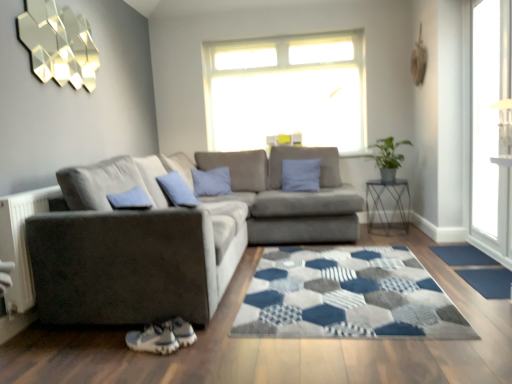
Describe the element at coordinates (462, 255) in the screenshot. I see `blue fabric doormat at lower right, arranged as the second doormat when viewed from the front` at that location.

The image size is (512, 384). What do you see at coordinates (153, 339) in the screenshot? I see `white mesh shoe at lower left` at bounding box center [153, 339].

You are a GUI agent. You are given a task and a screenshot of the screen. Output one action in this format:
    pyautogui.click(x=<x>, y=<y>)
    Task: Click on the transparent glass door at right
    The width and height of the screenshot is (512, 384).
    Given the screenshot: What is the action you would take?
    pyautogui.click(x=490, y=117)

Identify the location of blue fabric doormat at lower right, placed as the 1th doormat when sorted from front to back. (489, 282).

Find the location of a particular element. The width and height of the screenshot is (512, 384). metallic wire table at right is located at coordinates (389, 208).

At what (x,y) coordinates should I click in order to perform the action: click on blue fabric doormat at lower right, acting as the first doormat starting from the back. Please return your answer as a coordinate pair (x, y). The width and height of the screenshot is (512, 384). Looking at the image, I should click on (462, 255).

Locate an element on the screen. glass door in front of the blue fabric pillow at center is located at coordinates (490, 117).

Is blue fabric pillow at center oriented away from transparent glass door at right?

No, transparent glass door at right is not at the back of blue fabric pillow at center.

Considering the points (188, 193) and (480, 226), which point is behind, point (188, 193) or point (480, 226)?

Point (188, 193)

Between white plastic radiator at lower left and white mesh shoe at lower left, which one has more height?

With more height is white plastic radiator at lower left.

From a real-world perspective, is white plastic radiator at lower left over white mesh shoe at lower left?

Yes, from a real-world perspective, white plastic radiator at lower left is over white mesh shoe at lower left

Which object is positioned more to the right, white plastic radiator at lower left or white mesh shoe at lower left?

white mesh shoe at lower left.

Considering the positions of objects white plastic radiator at lower left and white mesh shoe at lower left in the image provided, who is behind, white plastic radiator at lower left or white mesh shoe at lower left?

white plastic radiator at lower left is behind.

Based on the photo, could you tell me if transparent glass door at right is facing suede gray couch at center?

Yes, transparent glass door at right is facing suede gray couch at center.

Is transparent glass door at right beside suede gray couch at center?

No, transparent glass door at right is not in contact with suede gray couch at center.

From the image's perspective, between transparent glass door at right and suede gray couch at center, which one is located above?

transparent glass door at right.

Is point (498, 0) closer or farther from the camera than point (128, 258)?

Point (498, 0).

From the image's perspective, is blue fabric doormat at lower right, acting as the first doormat starting from the back, positioned above or below transparent glass door at right?

blue fabric doormat at lower right, acting as the first doormat starting from the back, is below transparent glass door at right.

Is blue fabric doormat at lower right, arranged as the second doormat when viewed from the front, bigger than transparent glass door at right?

Actually, blue fabric doormat at lower right, arranged as the second doormat when viewed from the front, might be smaller than transparent glass door at right.

Considering the positions of objects blue fabric doormat at lower right, acting as the first doormat starting from the back, and transparent glass door at right in the image provided, who is more to the left, blue fabric doormat at lower right, acting as the first doormat starting from the back, or transparent glass door at right?

From the viewer's perspective, blue fabric doormat at lower right, acting as the first doormat starting from the back, appears more on the left side.

Which is behind, point (468, 250) or point (494, 72)?

The point (468, 250) is farther.

Can we say blue fabric pillow at center lies outside suede gray couch at center?

No, blue fabric pillow at center is inside suede gray couch at center's boundary.

From a real-world perspective, between blue fabric pillow at center and suede gray couch at center, who is vertically lower?

From a 3D spatial view, suede gray couch at center is below.

Which of these two, blue fabric pillow at center or suede gray couch at center, stands taller?

suede gray couch at center.

Is white mesh shoe at lower left looking in the opposite direction of blue fabric doormat at lower right, acting as the first doormat starting from the back?

white mesh shoe at lower left does not have its back to blue fabric doormat at lower right, acting as the first doormat starting from the back.

Is white mesh shoe at lower left located outside blue fabric doormat at lower right, arranged as the second doormat when viewed from the front?

Absolutely, white mesh shoe at lower left is external to blue fabric doormat at lower right, arranged as the second doormat when viewed from the front.

Does white mesh shoe at lower left have a smaller size compared to blue fabric doormat at lower right, arranged as the second doormat when viewed from the front?

Yes, white mesh shoe at lower left is smaller than blue fabric doormat at lower right, arranged as the second doormat when viewed from the front.

From a real-world perspective, who is located lower, white mesh shoe at lower left or blue fabric doormat at lower right, arranged as the second doormat when viewed from the front?

From a 3D spatial view, blue fabric doormat at lower right, arranged as the second doormat when viewed from the front, is below.

Considering the points (451, 251) and (161, 195), which point is in front, point (451, 251) or point (161, 195)?

Positioned in front is point (161, 195).

From the picture: Is suede gray couch at center located within blue fabric doormat at lower right, arranged as the second doormat when viewed from the front?

No, suede gray couch at center is located outside of blue fabric doormat at lower right, arranged as the second doormat when viewed from the front.

Between blue fabric doormat at lower right, arranged as the second doormat when viewed from the front, and suede gray couch at center, which one is positioned behind?

blue fabric doormat at lower right, arranged as the second doormat when viewed from the front, is further from the camera.

Is blue fabric doormat at lower right, arranged as the second doormat when viewed from the front, facing away from suede gray couch at center?

That's not correct — blue fabric doormat at lower right, arranged as the second doormat when viewed from the front, is not looking away from suede gray couch at center.

The image size is (512, 384). Find the location of `pillow behind the transparent glass door at right`. pillow behind the transparent glass door at right is located at coordinates tap(177, 190).

Where is `radiator that appears on the left of white mesh shoe at lower left`? This screenshot has height=384, width=512. radiator that appears on the left of white mesh shoe at lower left is located at coordinates (21, 242).

Which object lies nearer to the anchor point blue fabric doormat at lower right, which is counted as the second doormat, starting from the back, suede gray couch at center or metallic wire table at right?

Based on the image, metallic wire table at right appears to be nearer to blue fabric doormat at lower right, which is counted as the second doormat, starting from the back.

Estimate the real-world distances between objects in this image. Which object is further from white plastic radiator at lower left, white mesh shoe at lower left or blue fabric doormat at lower right, acting as the first doormat starting from the back?

Based on the image, blue fabric doormat at lower right, acting as the first doormat starting from the back, appears to be further to white plastic radiator at lower left.

From the image, which object appears to be farther from transparent glass door at right, blue fabric pillow at center or suede gray couch at center?

Based on the image, blue fabric pillow at center appears to be further to transparent glass door at right.

In the scene shown: From the image, which object appears to be farther from white plastic radiator at lower left, metallic wire table at right or blue fabric doormat at lower right, arranged as the second doormat when viewed from the front?

The object further to white plastic radiator at lower left is metallic wire table at right.

From the image, which object appears to be nearer to blue fabric doormat at lower right, acting as the first doormat starting from the back, white mesh shoe at lower left or white plastic radiator at lower left?

white mesh shoe at lower left lies closer to blue fabric doormat at lower right, acting as the first doormat starting from the back, than the other object.

Considering their positions, is white mesh shoe at lower left positioned closer to blue fabric pillow at center than green leafy plant at right?

white mesh shoe at lower left is closer to blue fabric pillow at center.

Which object lies nearer to the anchor point green leafy plant at right, suede gray couch at center or blue fabric doormat at lower right, which is counted as the second doormat, starting from the back?

blue fabric doormat at lower right, which is counted as the second doormat, starting from the back, is positioned closer to the anchor green leafy plant at right.

Which object lies further to the anchor point blue fabric pillow at center, suede gray couch at center or green leafy plant at right?

green leafy plant at right.

Locate an element on the screen. The height and width of the screenshot is (384, 512). doormat between white plastic radiator at lower left and blue fabric doormat at lower right, acting as the first doormat starting from the back, from left to right is located at coordinates (x=489, y=282).

Where is `doormat between blue fabric doormat at lower right, which is counted as the second doormat, starting from the back, and metallic wire table at right from front to back`? doormat between blue fabric doormat at lower right, which is counted as the second doormat, starting from the back, and metallic wire table at right from front to back is located at coordinates (462, 255).

In order to click on studio couch situated between white plastic radiator at lower left and blue fabric doormat at lower right, placed as the 1th doormat when sorted from front to back, from left to right in this screenshot , I will do `click(168, 246)`.

The width and height of the screenshot is (512, 384). I want to click on table located between white plastic radiator at lower left and blue fabric doormat at lower right, arranged as the second doormat when viewed from the front, in the left-right direction, so click(389, 208).